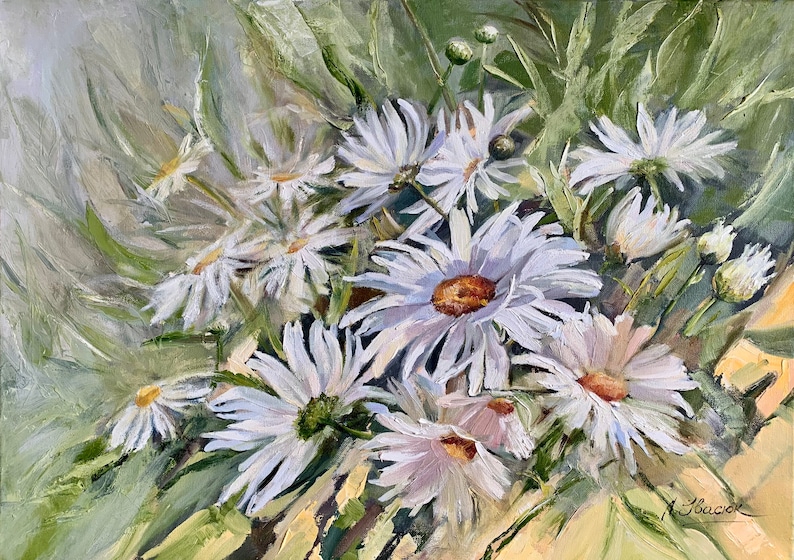
The image size is (794, 560). Find the location of `lower right corner of painting`. lower right corner of painting is located at coordinates (792, 556).